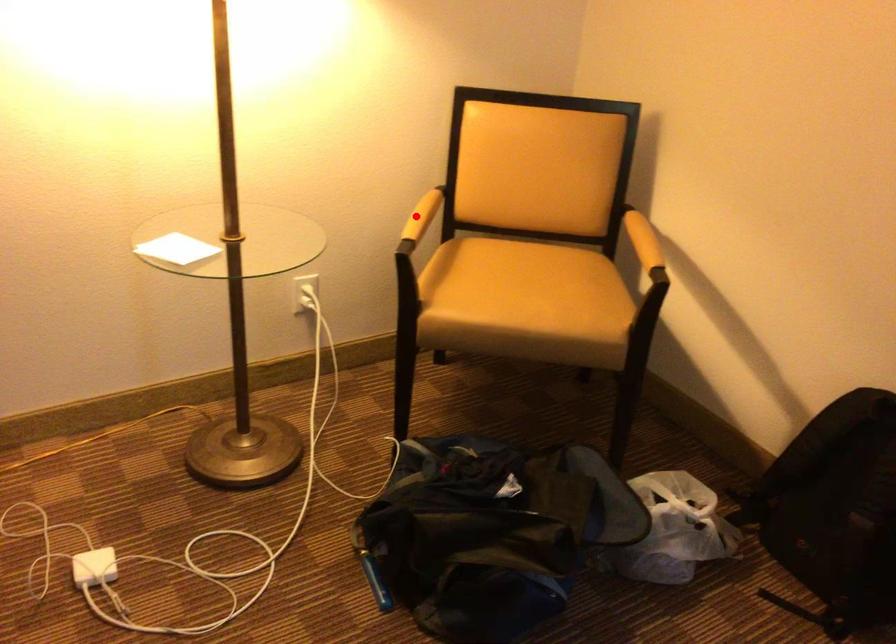
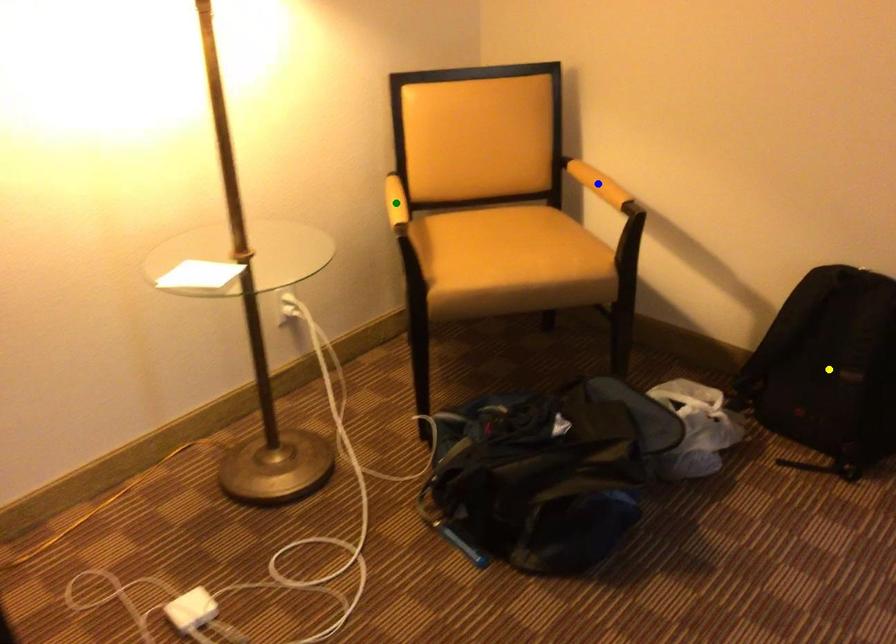
Question: I am providing you with two images of the same scene from different viewpoints. A red point is marked on the first image. You are given multiple points on the second image. Which spot in image 2 lines up with the point in image 1?

Choices:
 (A) yellow point
 (B) green point
 (C) blue point

Answer: (B)